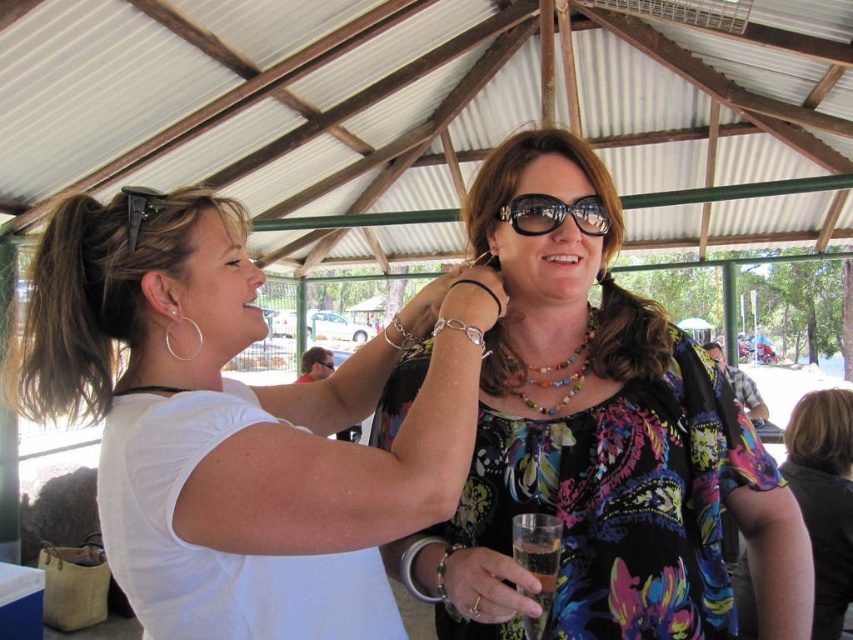
You are a photographer standing at the center of the scene. You want to capture a photo that includes both the dark brown hair at lower right and the multicolored beaded necklace at center. Given that your camera has a maximum zoom range of 1.5 meters, will you be able to fit both objects in the frame without moving closer?

The distance between the dark brown hair at lower right and the multicolored beaded necklace at center is 1.56 meters. Since the camera can only zoom up to 1.5 meters, you will not be able to fit both objects in the frame without moving closer.

You are standing at the point with coordinates point (x=519, y=198) and want to walk towards the point (x=531, y=556). Which direction should you move to get closer to it?

Since point (x=531, y=556) is closer to the viewer than point (x=519, y=198), you should move forward towards the direction of the point (x=531, y=556) to get closer to it.

You are a photographer at a social event and need to ensure both the multicolored floral blouse at center and the clear plastic glass at center are visible in your shot. Which object should you focus on first to ensure both are in frame?

The multicolored floral blouse at center is taller than the clear plastic glass at center, so focusing on the multicolored floral blouse at center first will ensure the glass is also captured since it is shorter.